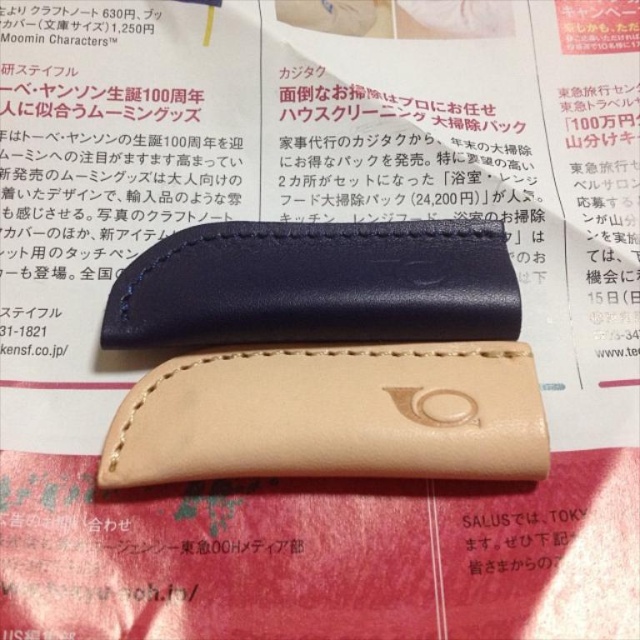
You are organizing a display for a leather goods store and need to arrange the tan leather case at center and the matte black leather case at upper center based on their sizes. Which case should be placed first if you want to start with the larger one?

The tan leather case at center is bigger than the matte black leather case at upper center, so you should place the tan leather case at center first.

You are designing a layout for a product catalog and need to place two leather cases on a page. The tan leather case at center and the matte black leather case at upper center are currently 12.53 centimeters apart. If you want to ensure there is at least 15 centimeters of space between them for text, should you move them closer together or farther apart?

The tan leather case at center and the matte black leather case at upper center are currently 12.53 centimeters apart. To achieve at least 15 centimeters of space between them, you should move them farther apart.